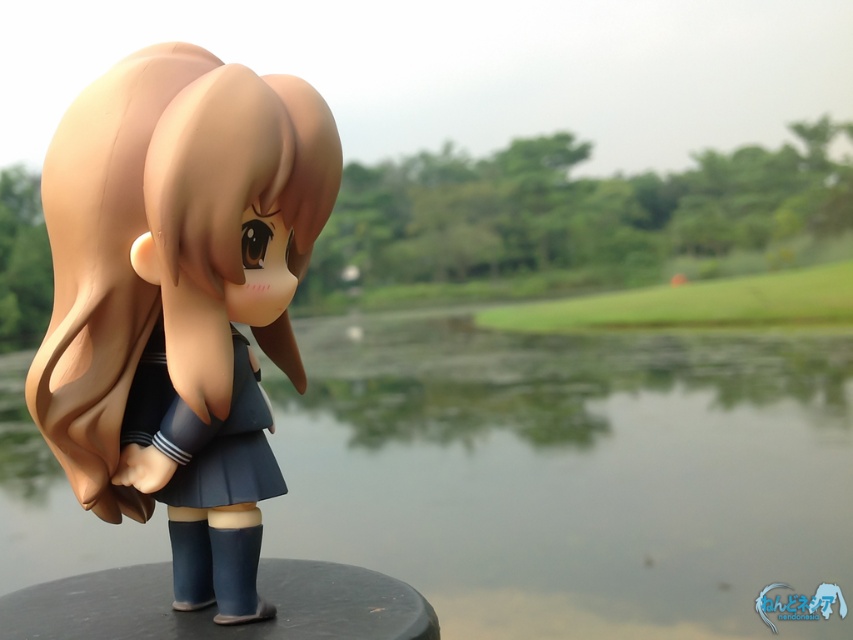
You are a photographer trying to capture the figurine from above. Based on the scene, will the green grass at center be visible above the satin brown hair at center?

The satin brown hair at center is positioned under green grass at center, so yes, the green grass at center will be visible above the satin brown hair at center when viewed from above.

Where is the satin brown hair at center located in the image?

The satin brown hair at center is located at point (178, 298) in the image.

You are a collector who wants to place this figurine on a shelf that has a width of 10 centimeters. Given that the distance between the satin brown hair at center and the satin blue skirt at center is 6.58 centimeters, will the entire figurine fit on the shelf?

The distance between the satin brown hair at center and the satin blue skirt at center is 6.58 centimeters, so the entire figurine will fit on the 10 centimeter wide shelf since 6.58 cm is less than 10 cm.